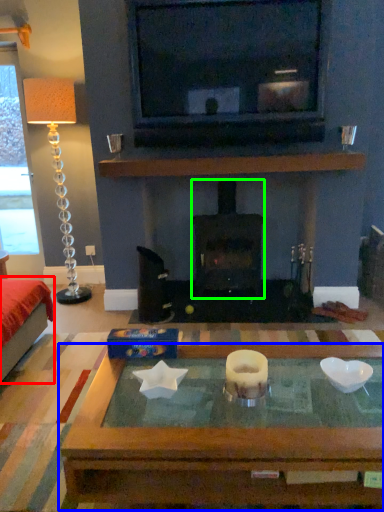
Question: Which is nearer to the furniture (highlighted by a red box)? coffee table (highlighted by a blue box) or wood burning stove (highlighted by a green box).

Choices:
 (A) coffee table
 (B) wood burning stove

Answer: (A)